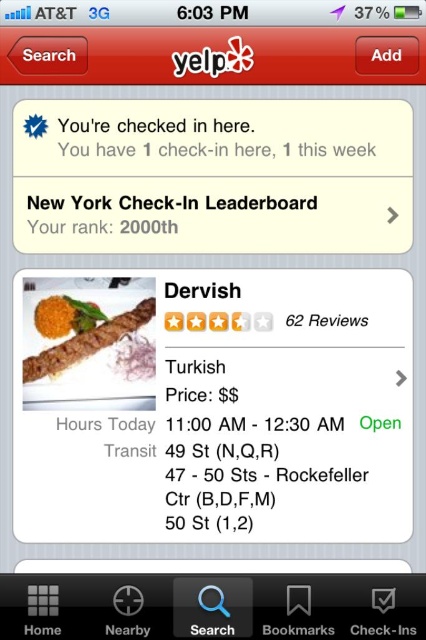
You are using the Yelp app to check in at Dervish. You see a point marked at coordinates (86, 342) on the screen. What object is located at that point?

The point at coordinates (86, 342) is where the brown matte kebab at center is located.

From the picture: You are using the Yelp app to decide between two dishes at Dervish restaurant. The brown matte kebab at center and the orange matte curry at center are both displayed on the menu. Which dish is positioned to the right side of the screen?

The brown matte kebab at center is positioned to the right of the orange matte curry at center, so the brown matte kebab at center is on the right side of the screen.